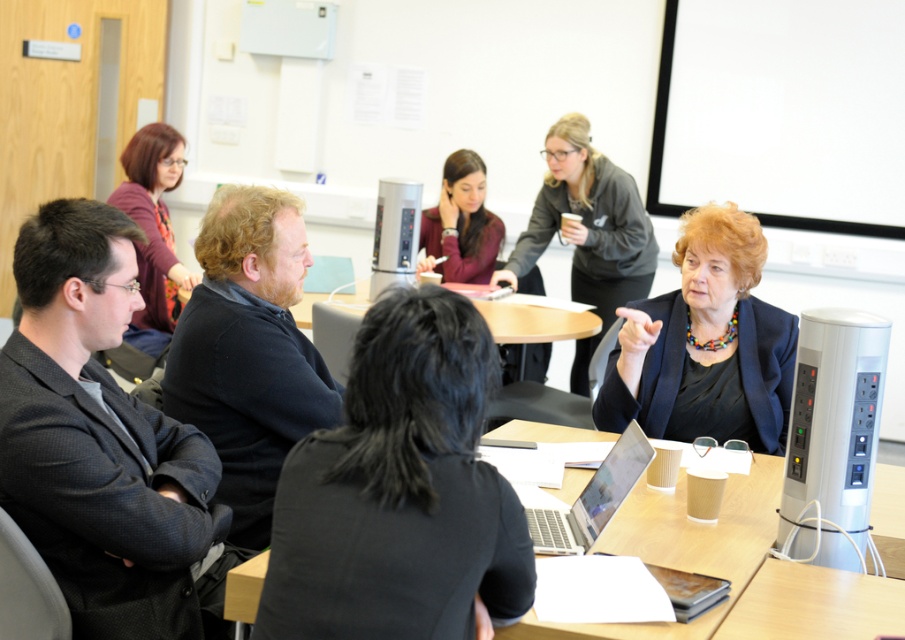
You are a photographer trying to capture a closeup of the silver metallic laptop at center without including the black glossy blazer at center in the frame. Given their positions, is this possible?

The black glossy blazer at center is taller than the silver metallic laptop at center, so the blazer would likely block the view of the laptop if they are at the same center position. Therefore, capturing a closeup of the silver metallic laptop at center without including the blazer might not be possible without adjusting the camera angle or moving closer.

You are organizing a photoshoot and need to arrange two key items in the scene for a closeup shot. The items are the black glossy blazer at center and the matte maroon sweater at center. According to the scene description, which item is positioned lower in the image?

The black glossy blazer at center is positioned lower than the matte maroon sweater at center in the image.

You are standing in the conference room and want to place a small plant on the table at point (637,304). If the table is 3 feet wide, can you safely place the plant there without it being too close to the edge?

The distance of point (637,304) from the camera is 8.59 feet, but this measurement doesn